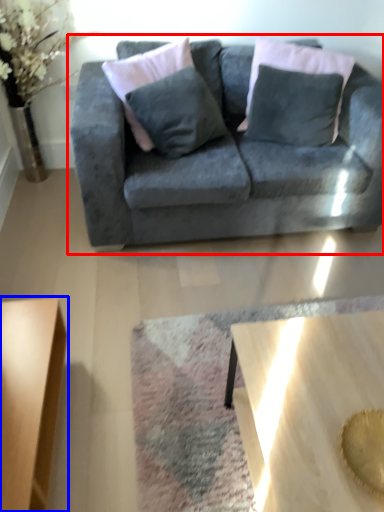
Question: Which of the following is the farthest to the observer, studio couch (highlighted by a red box) or coffee table (highlighted by a blue box)?

Choices:
 (A) studio couch
 (B) coffee table

Answer: (A)